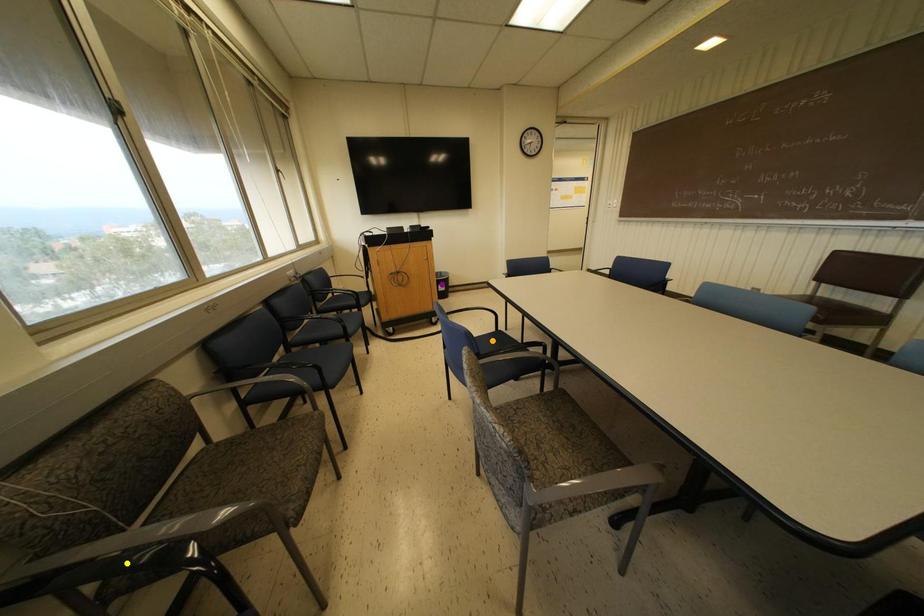
Order these from nearest to farthest:
- orange point
- purple point
- yellow point

yellow point
orange point
purple point